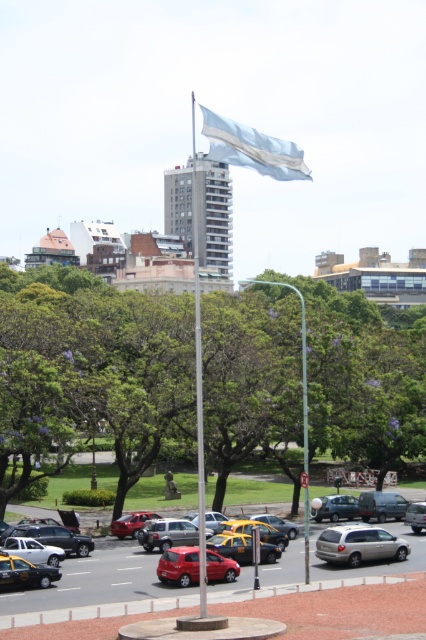
Question: Is white glossy flag pole at center to the left of metallic silver sedan at center from the viewer's perspective?

Choices:
 (A) no
 (B) yes

Answer: (B)

Question: Is matte black car at center positioned in front of silver metallic van at center?

Choices:
 (A) yes
 (B) no

Answer: (B)

Question: Which point appears closest to the camera in this image?

Choices:
 (A) (196, 301)
 (B) (247, 388)
 (C) (230, 550)
 (D) (19, 552)

Answer: (A)

Question: Which point is closer to the camera?

Choices:
 (A) yellowmattetaxi at center
 (B) matte black car at center
 (C) white fabric flag at center
 (D) yellow plastic taxi at lower left

Answer: (C)

Question: Which is farther from the silver metallic minivan at center?

Choices:
 (A) shiny red car at center
 (B) green leafy tree at center
 (C) white glossy flag pole at center

Answer: (B)

Question: Is metallic silver sedan at center to the right of matte red car at center from the viewer's perspective?

Choices:
 (A) no
 (B) yes

Answer: (B)